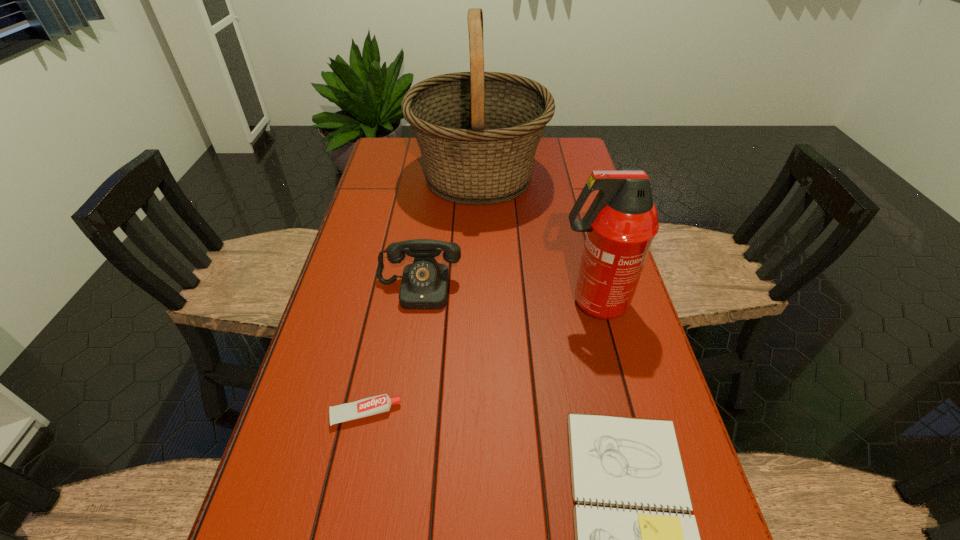
Locate an element on the screen. The image size is (960, 540). the farthest object is located at coordinates (478, 132).

Where is `the tallest object`? the tallest object is located at coordinates (478, 132).

Find the location of a particular element. The image size is (960, 540). fire extinguisher is located at coordinates (621, 222).

Where is `telephone`? The image size is (960, 540). telephone is located at coordinates (424, 285).

Where is `the fourth tallest object`? The image size is (960, 540). the fourth tallest object is located at coordinates (374, 405).

Locate an element on the screen. blank space located 0.380m on the front of the tallest object is located at coordinates (478, 308).

Image resolution: width=960 pixels, height=540 pixels. Identify the location of vacant space situated 0.280m on the trigger side of the fire extinguisher. (444, 303).

What are the coordinates of `vacant space located 0.200m on the trigger side of the fire extinguisher` in the screenshot? It's located at (476, 303).

Locate an element on the screen. This screenshot has width=960, height=540. blank space located 0.130m on the trigger side of the fire extinguisher is located at coordinates (504, 303).

Identify the location of vacant space situated on the dial of the telephone. (410, 353).